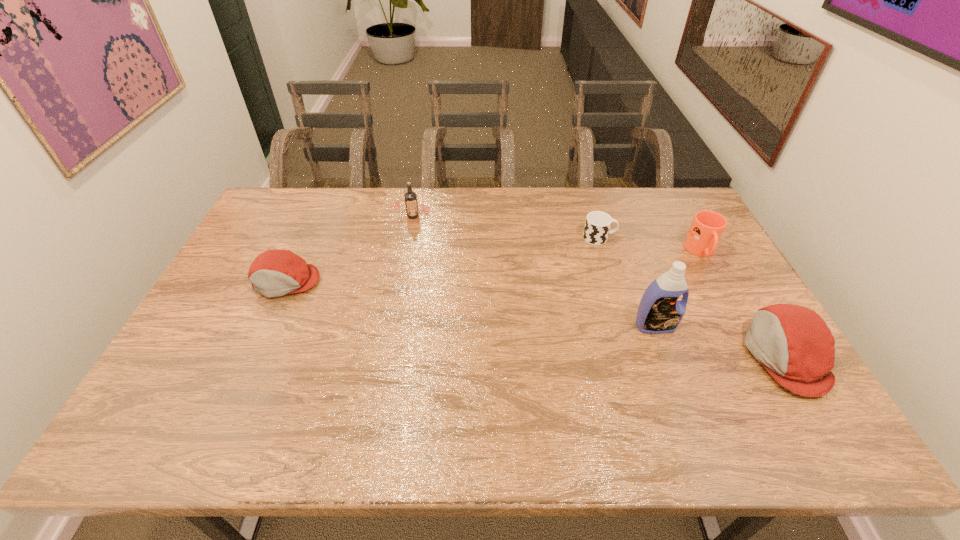
Locate an element on the screen. Image resolution: width=960 pixels, height=540 pixels. free space in the image that satisfies the following two spatial constraints: 1. on the back side of the detergent; 2. on the side of the cup with the handle is located at coordinates (622, 238).